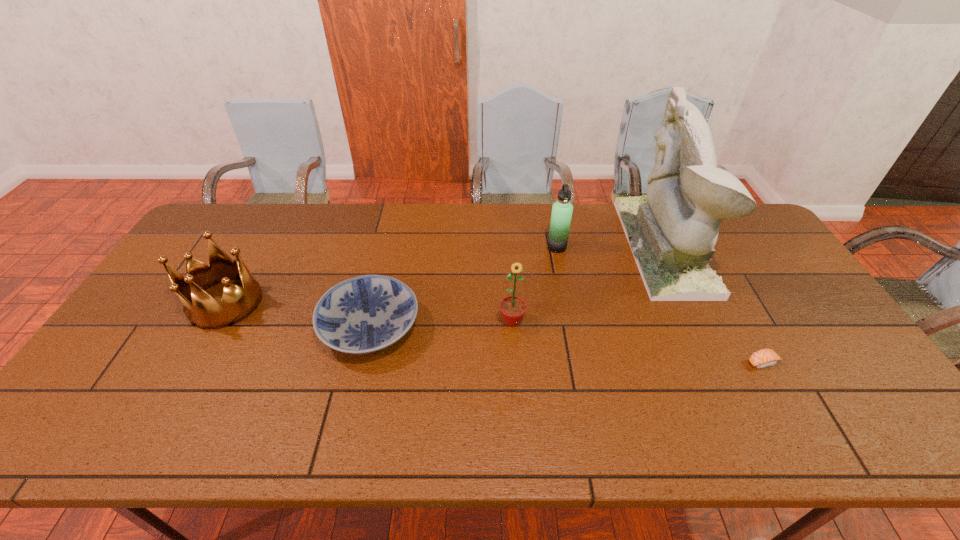
This screenshot has width=960, height=540. I want to click on free space at the near edge of the desktop, so click(x=396, y=443).

Where is `free space at the left edge`? The width and height of the screenshot is (960, 540). free space at the left edge is located at coordinates (170, 320).

Find the location of a particular element. Image resolution: width=960 pixels, height=540 pixels. vacant space at the right edge of the desktop is located at coordinates (773, 284).

Locate an element on the screen. The height and width of the screenshot is (540, 960). free space at the far left corner is located at coordinates (220, 217).

In the image, there is a desktop. Identify the location of free region at the near left corner. (103, 445).

The height and width of the screenshot is (540, 960). In the image, there is a desktop. Find the location of `free space at the near right corner`. free space at the near right corner is located at coordinates (840, 439).

Image resolution: width=960 pixels, height=540 pixels. In order to click on unoccupied position between the second object from left to right and the sculpture in this screenshot , I will do `click(516, 287)`.

The image size is (960, 540). In order to click on empty space between the thermos bottle and the second object from left to right in this screenshot , I will do `click(464, 287)`.

Identify the location of free area in between the sunflower and the shortest object. Image resolution: width=960 pixels, height=540 pixels. (637, 342).

The image size is (960, 540). I want to click on free space between the sunflower and the plate, so click(441, 324).